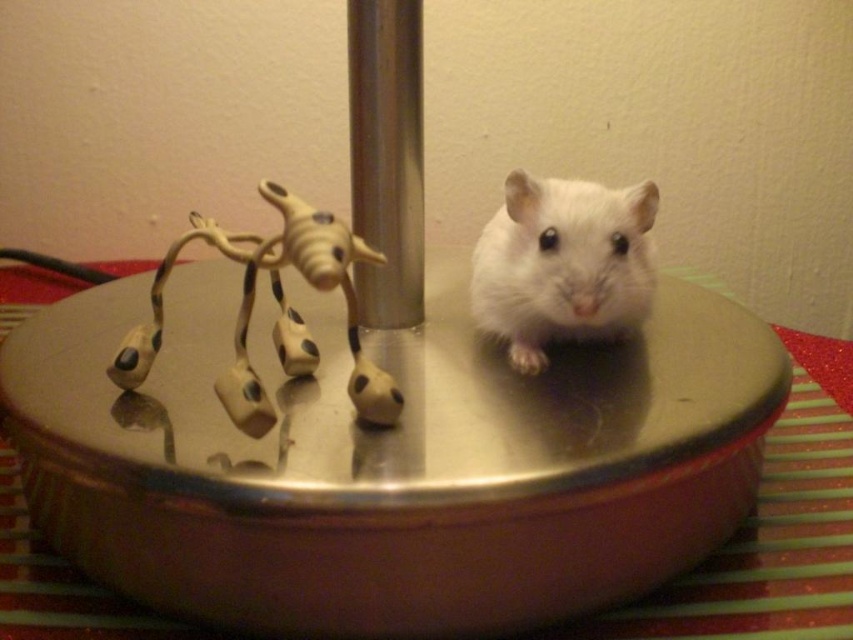
In the scene, there is a white fur hamster at center and a silver metallic pole at center. Which object is taller?

The silver metallic pole at center is taller than the white fur hamster at center.

You are a photographer setting up a shot of the white fur hamster at center. The camera is positioned at point A, which is at coordinates point [561,262]. To ensure the hamster is in focus, where should you aim the camera?

The point [561,262] corresponds to the white fur hamster at center, so you should aim the camera directly at that point to ensure the hamster is in focus.